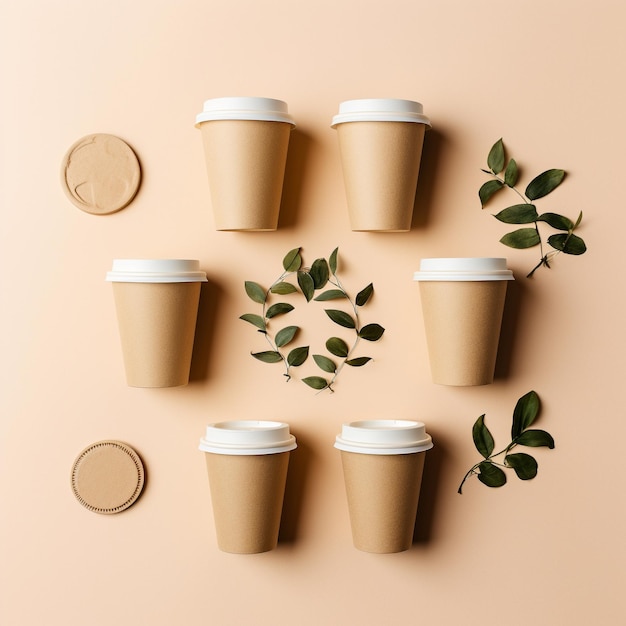
Locate an element on the screen. This screenshot has width=626, height=626. cups that hold coffee is located at coordinates (255, 496), (403, 481), (467, 340), (364, 176), (228, 217), (148, 334).